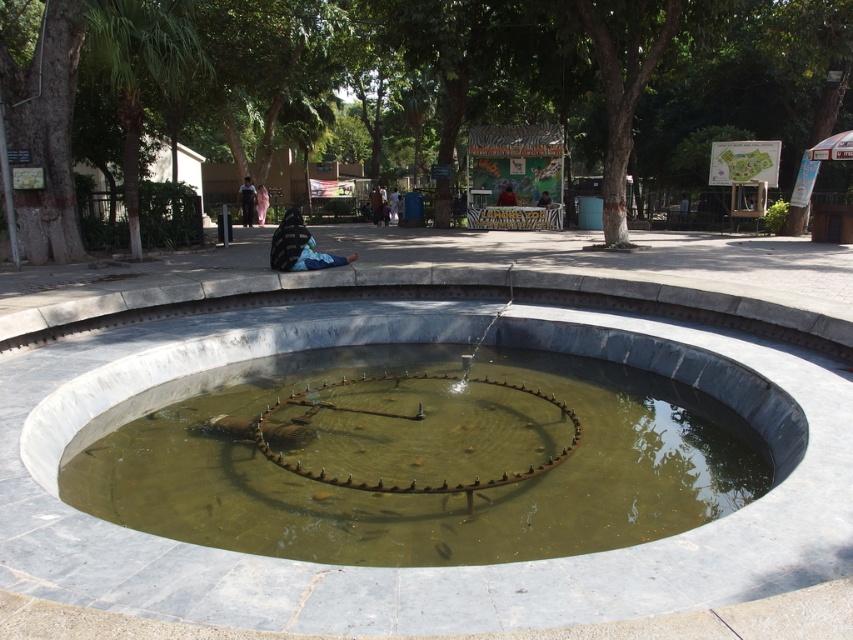
You are standing at the center of the circular water feature and want to walk to the park area beyond the paved tiles. There are two points marked on the ground as reference points. Which point should you head towards first to reach the park area? The two points are point 1 at coordinates point (x=148, y=486) and point 2 at coordinates point (x=241, y=202). Please choose between point 1 or point 2.

You should head towards point 1 at coordinates point (x=148, y=486) first because it is in front of point 2 at coordinates point (x=241, y=202), meaning it is closer to the park area beyond the paved tiles.

You are standing at the edge of the water feature and want to walk to the light brown fabric shirt at center. There is a brown bark tree at center blocking your path. Can you walk around the tree to reach the shirt without getting wet?

The brown bark tree at center is 11.08 meters away from the light brown fabric shirt at center, so you can walk around the tree to reach the shirt without getting wet as the distance allows enough space to maneuver around the tree.

You are standing in the park and see the brown bark tree at center and the light brown fabric shirt at center. Which object is higher from the ground?

The brown bark tree at center is located above the light brown fabric shirt at center, so the brown bark tree at center is higher from the ground.